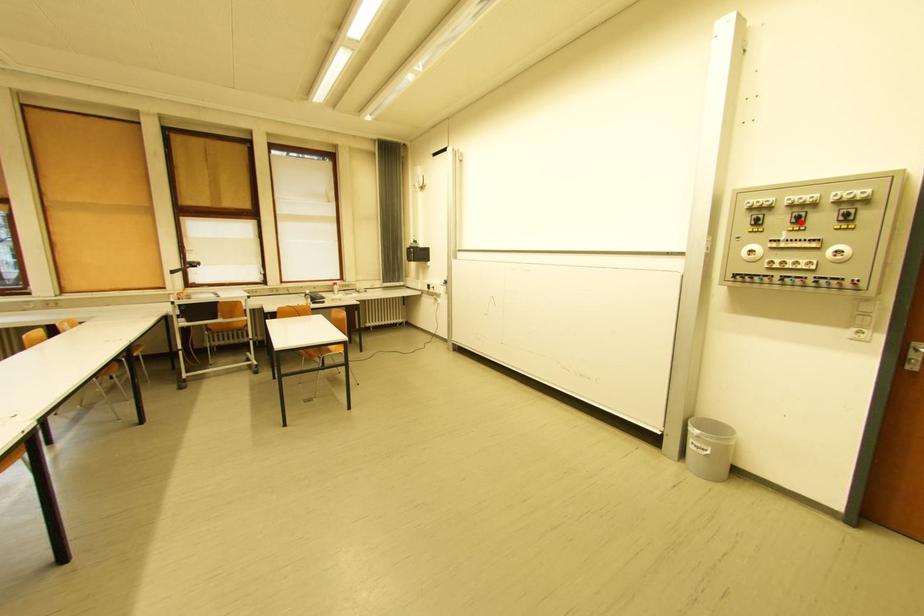
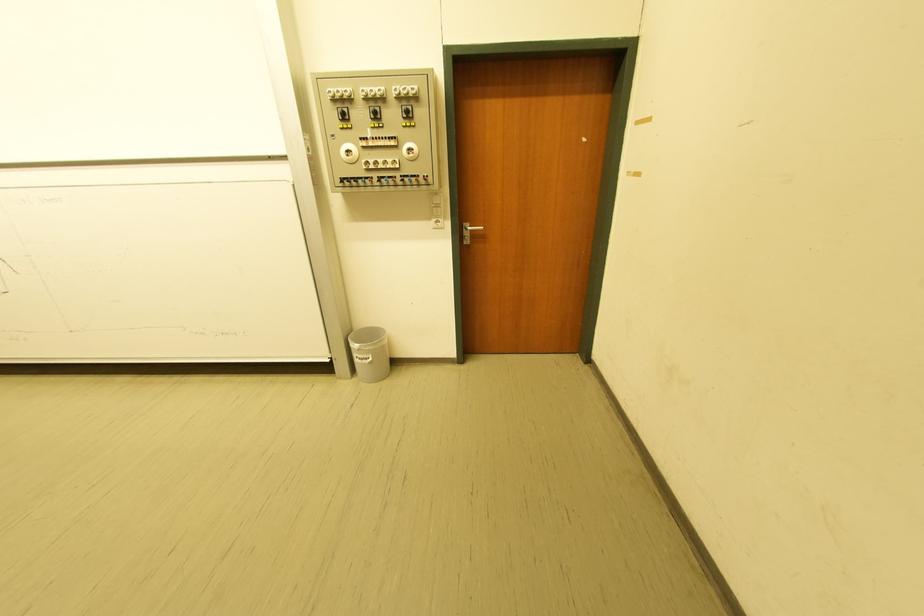
Locate, in the second image, the point that corresponds to the highlighted location in the first image.

(380, 118)